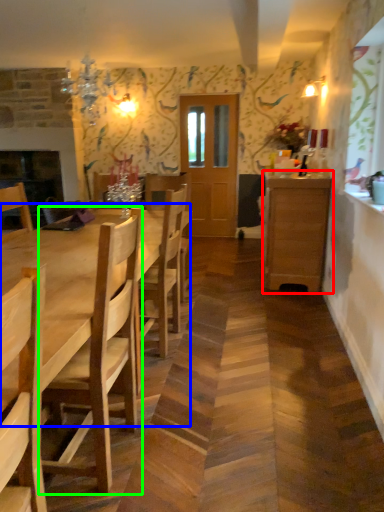
Question: Which object is the farthest from cabinetry (highlighted by a red box)? Choose among these: kitchen & dining room table (highlighted by a blue box) or chair (highlighted by a green box).

Choices:
 (A) kitchen & dining room table
 (B) chair

Answer: (B)